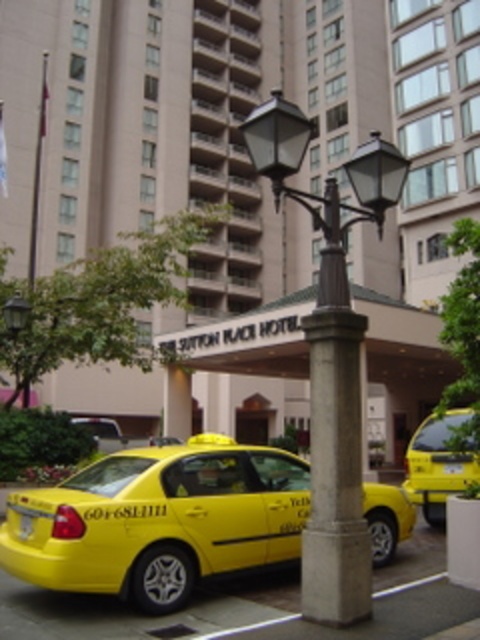
Question: Does polished bronze streetlight at center have a lesser width compared to yellow matte taxi cab at lower left?

Choices:
 (A) yes
 (B) no

Answer: (A)

Question: Is the position of polished bronze streetlight at center less distant than that of yellow matte taxi cab at lower left?

Choices:
 (A) no
 (B) yes

Answer: (B)

Question: Which object appears farthest from the camera in this image?

Choices:
 (A) polished bronze streetlight at center
 (B) yellow matte taxi cab at lower left

Answer: (B)

Question: Which is nearer to the yellow matte taxi at center?

Choices:
 (A) polished bronze streetlight at center
 (B) yellow plastic taxi cab at center
 (C) yellow matte taxi cab at lower left

Answer: (A)

Question: Which object is closer to the camera taking this photo?

Choices:
 (A) polished bronze streetlight at center
 (B) yellow plastic taxi cab at center
 (C) yellow matte taxi at center

Answer: (A)

Question: Does yellow plastic taxi cab at center have a greater width compared to yellow matte taxi at lower left?

Choices:
 (A) yes
 (B) no

Answer: (A)